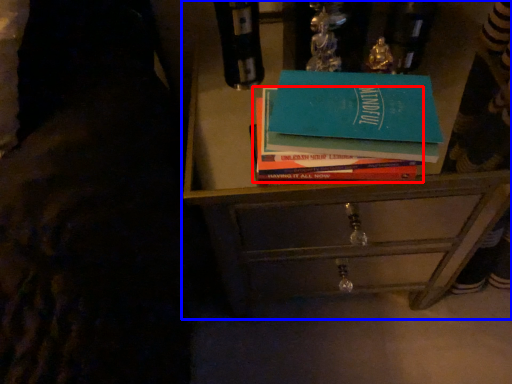
Question: Which object is further to the camera taking this photo, book (highlighted by a red box) or chest of drawers (highlighted by a blue box)?

Choices:
 (A) book
 (B) chest of drawers

Answer: (B)